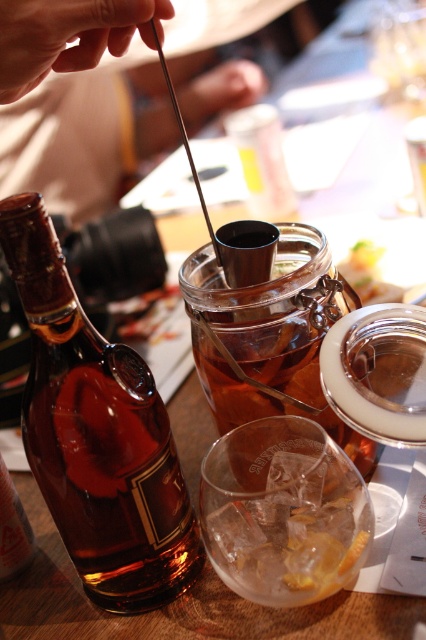
Question: Observing the image, what is the correct spatial positioning of metallic silver spoon at upper center in reference to translucent glass jar at center?

Choices:
 (A) above
 (B) below

Answer: (A)

Question: Which object is closer to the camera taking this photo?

Choices:
 (A) metallic silver spoon at upper center
 (B) brown glass bottle at left
 (C) translucent glass jar at center
 (D) clear glass at center

Answer: (B)

Question: Which object is closer to the camera taking this photo?

Choices:
 (A) translucent glass jar at center
 (B) brown glass bottle at left
 (C) clear glass at center
 (D) metallic silver spoon at upper center

Answer: (B)

Question: Is brown glass bottle at left positioned before translucent glass jar at center?

Choices:
 (A) no
 (B) yes

Answer: (B)

Question: Can you confirm if clear glass at center is smaller than translucent glass jar at center?

Choices:
 (A) yes
 (B) no

Answer: (A)

Question: Which point is closer to the camera?

Choices:
 (A) brown glass bottle at left
 (B) translucent glass jar at center
 (C) clear glass at center

Answer: (A)